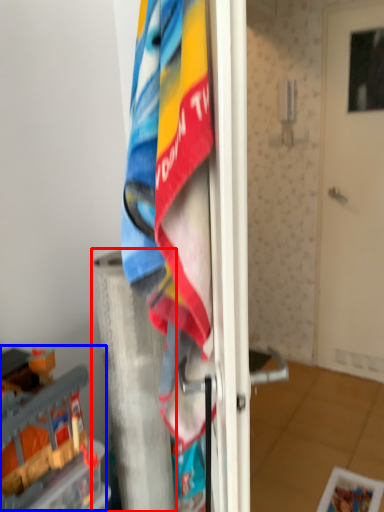
Question: Among these objects, which one is farthest to the camera, pillar (highlighted by a red box) or toy (highlighted by a blue box)?

Choices:
 (A) pillar
 (B) toy

Answer: (A)